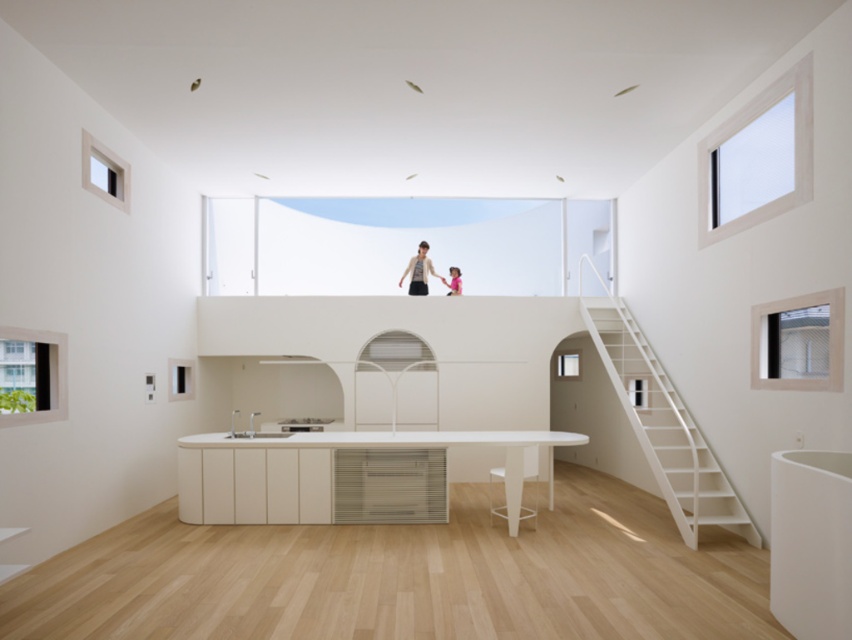
Question: Can you confirm if white matte hardwood at center is positioned below white glossy stool at lower center?

Choices:
 (A) no
 (B) yes

Answer: (A)

Question: Considering the real-world distances, which object is closest to the pink fabric at upper center?

Choices:
 (A) white matte hardwood at center
 (B) matte white shirt at upper center
 (C) white wooden staircase at right

Answer: (B)

Question: Does white matte hardwood at center appear under white wooden staircase at right?

Choices:
 (A) no
 (B) yes

Answer: (B)

Question: Which is farther from the white glossy stool at lower center?

Choices:
 (A) matte white shirt at upper center
 (B) white wooden staircase at right
 (C) pink fabric at upper center

Answer: (C)

Question: Which of these objects is positioned farthest from the pink fabric at upper center?

Choices:
 (A) white wooden staircase at right
 (B) white matte hardwood at center
 (C) white glossy stool at lower center

Answer: (B)

Question: Observing the image, what is the correct spatial positioning of white wooden staircase at right in reference to pink fabric at upper center?

Choices:
 (A) left
 (B) right

Answer: (B)